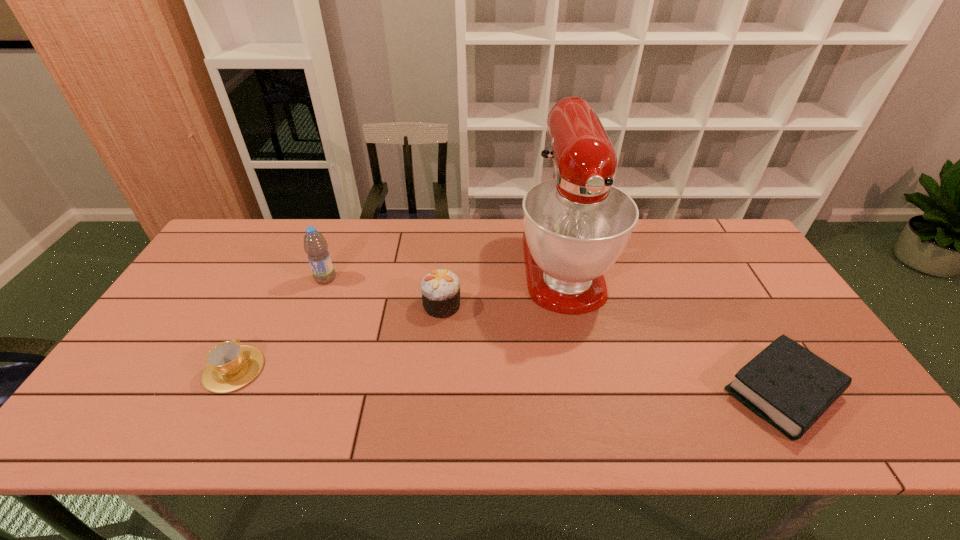
Image resolution: width=960 pixels, height=540 pixels. In order to click on free space at the near edge of the desktop in this screenshot , I will do `click(728, 428)`.

Where is `vacant space at the left edge of the desktop`? Image resolution: width=960 pixels, height=540 pixels. vacant space at the left edge of the desktop is located at coordinates (184, 352).

Image resolution: width=960 pixels, height=540 pixels. I want to click on vacant space at the right edge of the desktop, so click(x=756, y=291).

In the image, there is a desktop. At what (x,y) coordinates should I click in order to perform the action: click on free space at the far right corner. Please return your answer as a coordinate pair (x, y). Image resolution: width=960 pixels, height=540 pixels. Looking at the image, I should click on (732, 230).

Where is `vacant space at the near right corner`? vacant space at the near right corner is located at coordinates (857, 442).

Locate an element on the screen. This screenshot has width=960, height=540. unoccupied area between the third tallest object and the water bottle is located at coordinates (384, 292).

The height and width of the screenshot is (540, 960). In order to click on vacant point located between the leftmost object and the second object from left to right in this screenshot , I will do [x=279, y=324].

Locate an element on the screen. The image size is (960, 540). unoccupied area between the fourth object from left to right and the cup is located at coordinates (397, 317).

This screenshot has height=540, width=960. Identify the location of vacant space that's between the Bible and the mixer. (x=672, y=328).

At what (x,y) coordinates should I click in order to perform the action: click on free spot between the fourth object from right to left and the Bible. Please return your answer as a coordinate pair (x, y). Looking at the image, I should click on (554, 335).